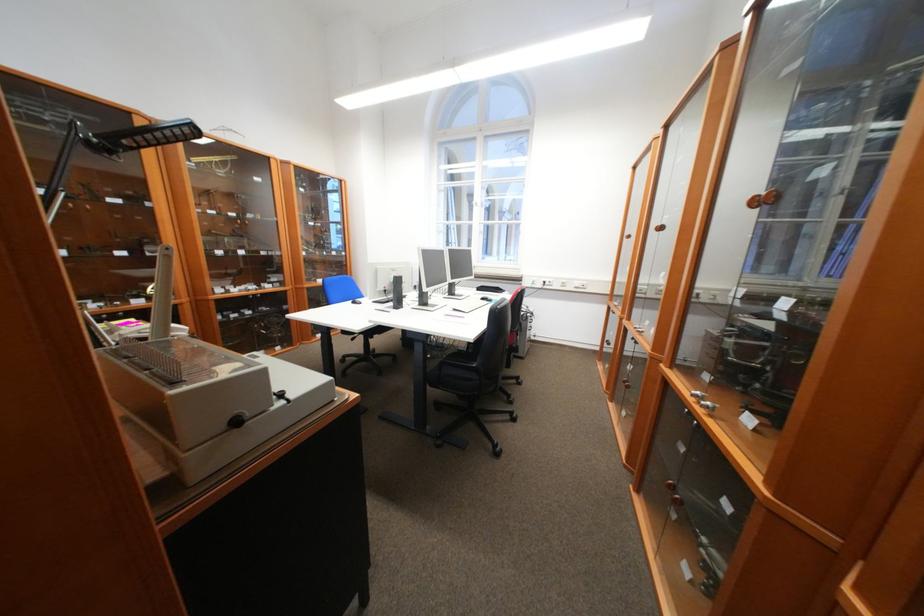
Describe the element at coordinates (475, 378) in the screenshot. I see `the black chair sitting surface` at that location.